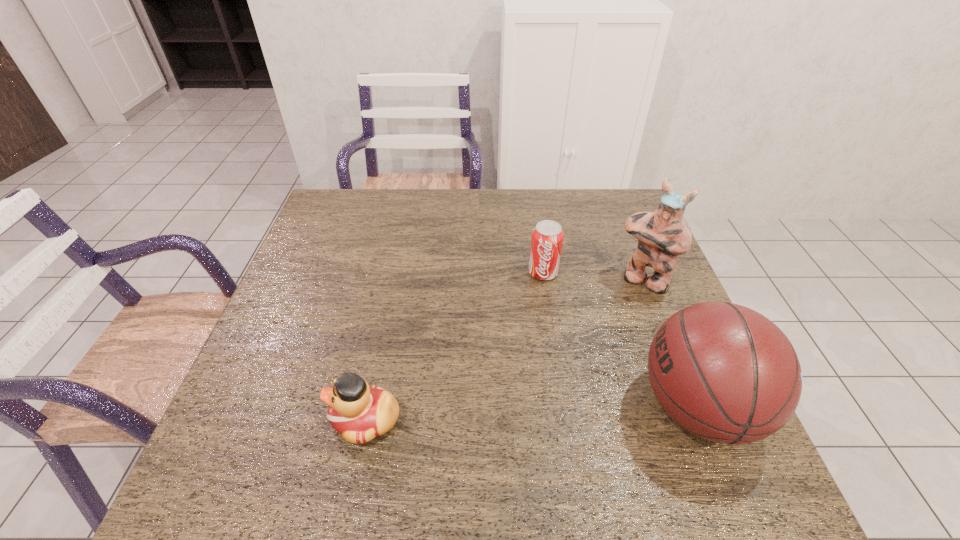
I want to click on free space on the desktop that is between the leftmost object and the basketball and is positioned on the logo side of the third object from right to left, so click(515, 414).

At what (x,y) coordinates should I click in order to perform the action: click on free space on the desktop that is between the shortest object and the basketball and is positioned on the front-facing side of the tallest object. Please return your answer as a coordinate pair (x, y). Image resolution: width=960 pixels, height=540 pixels. Looking at the image, I should click on (559, 412).